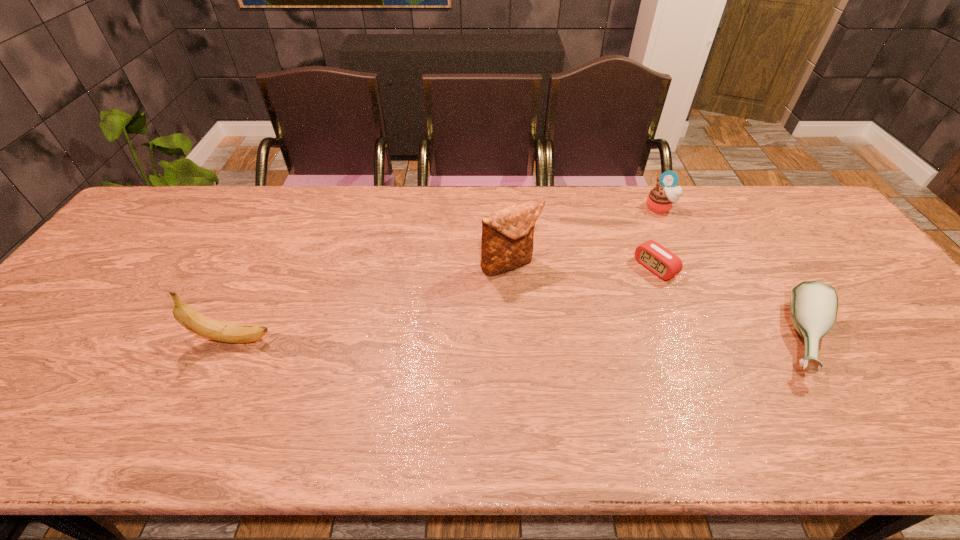
Locate an element on the screen. vacant space at the far edge of the desktop is located at coordinates (313, 203).

Locate an element on the screen. The width and height of the screenshot is (960, 540). vacant area at the near edge of the desktop is located at coordinates (494, 388).

In the image, there is a desktop. At what (x,y) coordinates should I click in order to perform the action: click on free region at the left edge. Please return your answer as a coordinate pair (x, y). This screenshot has height=540, width=960. Looking at the image, I should click on (153, 237).

The image size is (960, 540). I want to click on vacant space at the near left corner of the desktop, so click(x=33, y=393).

Identify the location of vacant area that lies between the farthest object and the clutch bag. Image resolution: width=960 pixels, height=540 pixels. (585, 236).

Identify the location of free point between the alarm clock and the fourth tallest object. Image resolution: width=960 pixels, height=540 pixels. (731, 303).

Image resolution: width=960 pixels, height=540 pixels. Identify the location of empty space between the farthest object and the shortest object. (658, 238).

At what (x,y) coordinates should I click in order to perform the action: click on vacant space in between the clutch bag and the fourth tallest object. Please return your answer as a coordinate pair (x, y). Looking at the image, I should click on (658, 302).

The image size is (960, 540). I want to click on blank region between the fourth object from right to left and the fourth tallest object, so click(658, 302).

Identify the location of empty space between the banana and the fourth object from right to left. This screenshot has width=960, height=540. (372, 302).